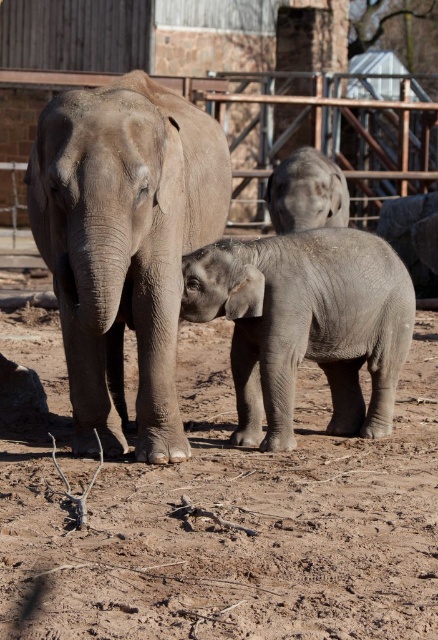
Question: Can you confirm if brown sandy dirt at center is wider than gray matte elephant at center?

Choices:
 (A) no
 (B) yes

Answer: (B)

Question: Which point appears farthest from the camera in this image?

Choices:
 (A) (179, 96)
 (B) (335, 189)
 (C) (357, 157)
 (D) (261, 502)

Answer: (C)

Question: Which of the following is the closest to the observer?

Choices:
 (A) gray matte elephant at upper center
 (B) gray matte elephant at center
 (C) metallic wire fence at upper center

Answer: (B)

Question: Observing the image, what is the correct spatial positioning of gray matte elephant at center in reference to metallic wire fence at upper center?

Choices:
 (A) right
 (B) left

Answer: (B)

Question: Which object is farther from the camera taking this photo?

Choices:
 (A) gray matte elephant at upper center
 (B) gray textured elephant at center
 (C) metallic wire fence at upper center

Answer: (C)

Question: Where is brown sandy dirt at center located in relation to gray textured elephant at center in the image?

Choices:
 (A) above
 (B) below

Answer: (B)